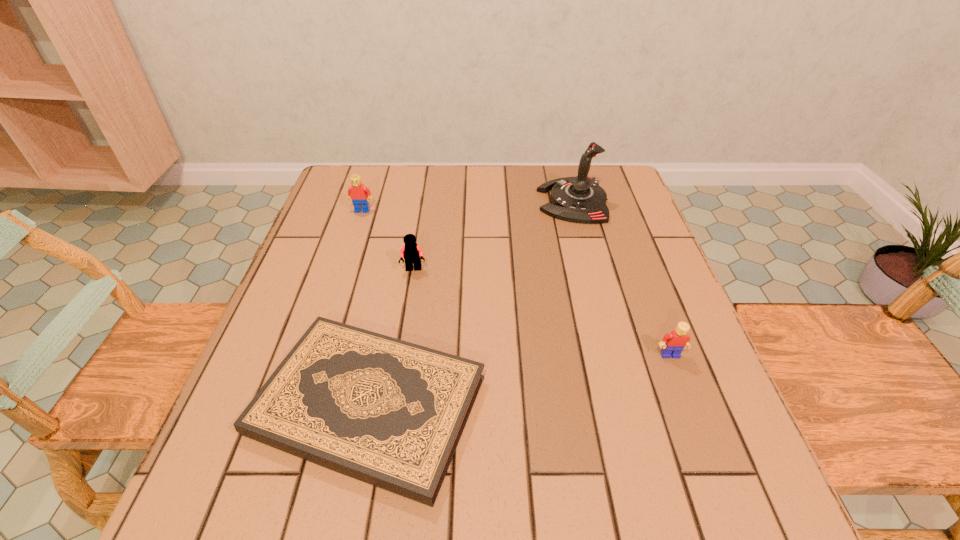
In order to click on object at the far left corner in this screenshot , I will do click(359, 194).

Where is `object located in the near left corner section of the desktop`? The image size is (960, 540). object located in the near left corner section of the desktop is located at coordinates (390, 413).

Image resolution: width=960 pixels, height=540 pixels. What are the coordinates of `object located in the far right corner section of the desktop` in the screenshot? It's located at (580, 199).

The height and width of the screenshot is (540, 960). I want to click on vacant area at the far edge of the desktop, so click(x=420, y=184).

Find the location of a particular element. The image size is (960, 540). free location at the left edge of the desktop is located at coordinates (309, 294).

This screenshot has height=540, width=960. Find the location of `blank space at the right edge of the desktop`. blank space at the right edge of the desktop is located at coordinates (637, 234).

In the image, there is a desktop. In order to click on vacant space at the far left corner in this screenshot , I will do `click(340, 179)`.

Identify the location of vacant space at the near left corner of the desktop. (216, 504).

This screenshot has width=960, height=540. I want to click on vacant space at the far right corner of the desktop, so click(610, 211).

This screenshot has width=960, height=540. I want to click on unoccupied position between the tallest object and the leftmost Lego, so click(x=468, y=206).